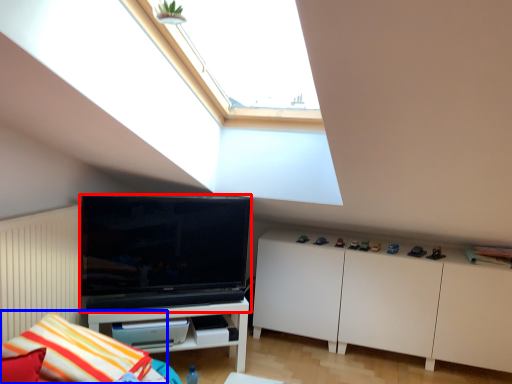
Question: Which point is further to the camera, television (highlighted by a red box) or pillow (highlighted by a blue box)?

Choices:
 (A) television
 (B) pillow

Answer: (A)